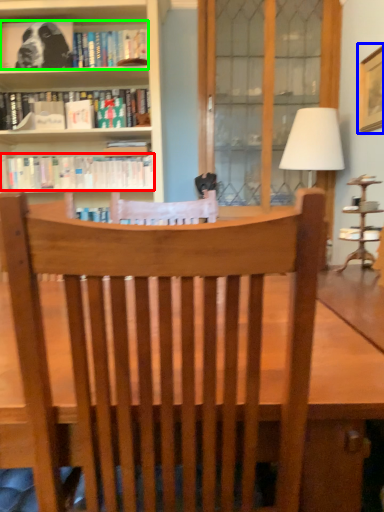
Question: Which object is the farthest from book (highlighted by a red box)? Choose among these: picture frame (highlighted by a blue box) or book (highlighted by a green box).

Choices:
 (A) picture frame
 (B) book

Answer: (A)